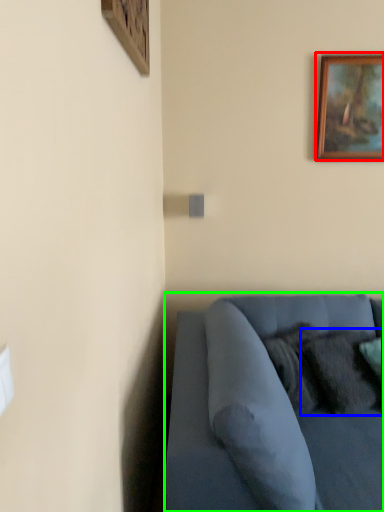
Question: Estimate the real-world distances between objects in this image. Which object is farther from picture frame (highlighted by a red box), pillow (highlighted by a blue box) or studio couch (highlighted by a green box)?

Choices:
 (A) pillow
 (B) studio couch

Answer: (B)